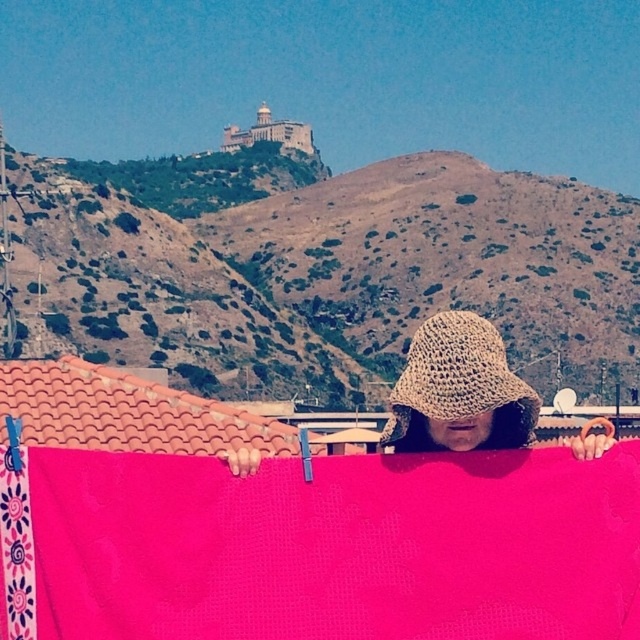
In the image, there is a person partially obscured by a pink woven cloth at center. The person is wearing a wide brimmed straw hat and holding the edges of the cloth. What object is located at the coordinates point (328, 547)?

The point (328, 547) marks the pink woven cloth at center.

You are standing in the outdoor scene and want to touch both the pink woven cloth at center and the crochet hat at center. Which object should you reach for first to touch the one closer to you?

The pink woven cloth at center is closer to the viewer than the crochet hat at center, so you should reach for the pink woven cloth at center first.